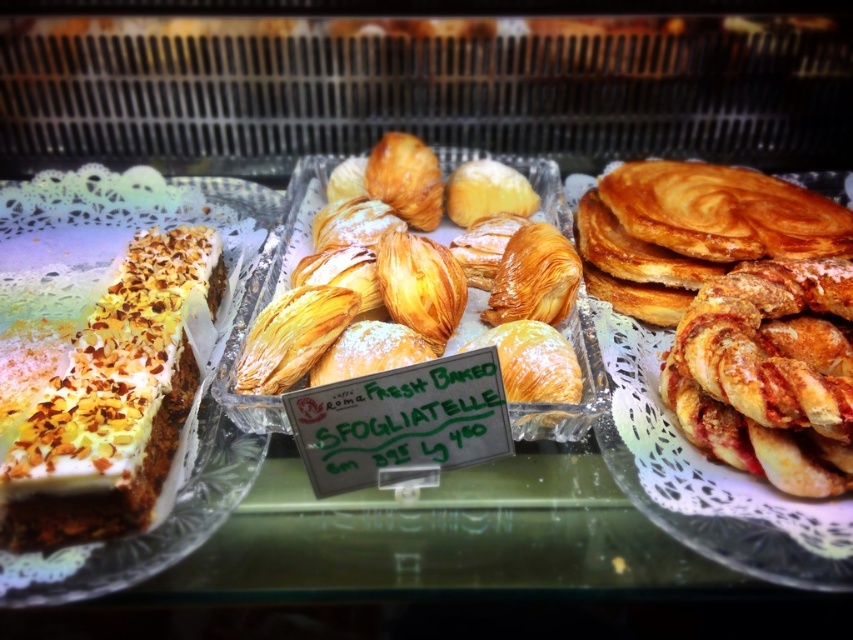
Question: Which object is positioned farthest from the golden crispy pastry at right?

Choices:
 (A) white cream topped with nuts at center
 (B) swirled golden pancake at right

Answer: (A)

Question: Considering the real-world distances, which object is closest to the white cream topped with nuts at center?

Choices:
 (A) golden flaky pastry at center
 (B) swirled golden pancake at right

Answer: (A)

Question: Which object is the closest to the white cream topped with nuts at center?

Choices:
 (A) swirled golden pancake at right
 (B) golden flaky pastry at center
 (C) golden crispy pastry at right

Answer: (B)

Question: Is golden flaky pastry at center to the right of golden crispy pastry at right from the viewer's perspective?

Choices:
 (A) no
 (B) yes

Answer: (A)

Question: Does white cream topped with nuts at center appear on the left side of golden flaky pastry at center?

Choices:
 (A) no
 (B) yes

Answer: (B)

Question: Is golden flaky pastry at center below swirled golden pancake at right?

Choices:
 (A) yes
 (B) no

Answer: (A)